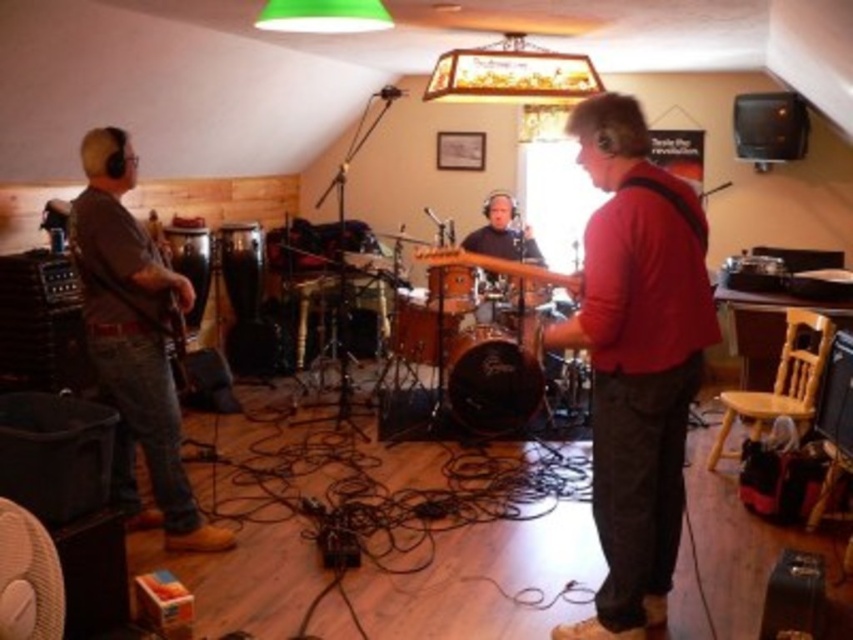
Question: Which point appears closest to the camera in this image?

Choices:
 (A) (466, 257)
 (B) (157, 468)
 (C) (16, 611)

Answer: (C)

Question: Can you confirm if red matte guitar at center is smaller than wooden drum at center?

Choices:
 (A) yes
 (B) no

Answer: (B)

Question: Which object is the closest to the red matte guitar at center?

Choices:
 (A) white fabric fan at lower left
 (B) brown denim jeans at left
 (C) wooden drum at center

Answer: (C)

Question: Which of the following is the farthest from the observer?

Choices:
 (A) wooden drum at center
 (B) brown denim jeans at left

Answer: (B)

Question: Can you confirm if brown denim jeans at left is smaller than white fabric fan at lower left?

Choices:
 (A) yes
 (B) no

Answer: (B)

Question: Can you confirm if red matte guitar at center is positioned to the left of white fabric fan at lower left?

Choices:
 (A) no
 (B) yes

Answer: (A)